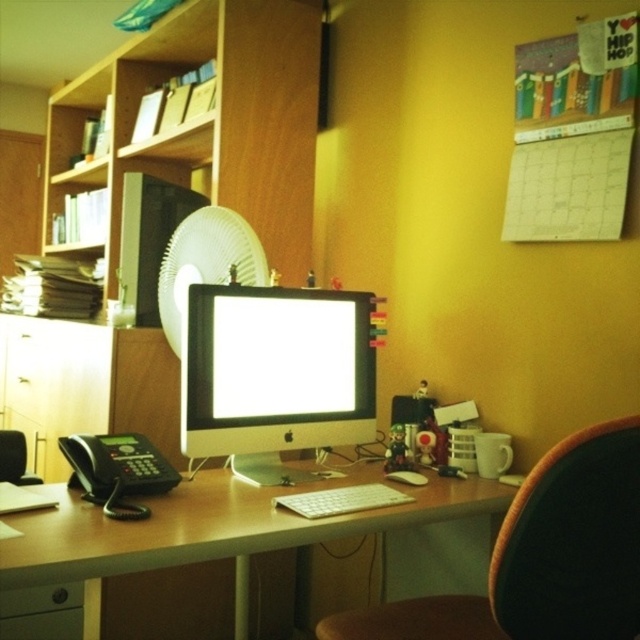
Question: Which object is closer to the camera taking this photo?

Choices:
 (A) black leather swivel chair at center
 (B) wooden bookshelf at upper left
 (C) black leather chair at left
 (D) white plastic computer desk at center

Answer: (A)

Question: Can you confirm if black leather swivel chair at center is wider than white plastic computer desk at center?

Choices:
 (A) yes
 (B) no

Answer: (B)

Question: Is black leather swivel chair at center below satin silver monitor at center?

Choices:
 (A) yes
 (B) no

Answer: (A)

Question: Which is farther from the wooden bookshelf at upper left?

Choices:
 (A) black leather swivel chair at center
 (B) white matte keyboard at center
 (C) white plastic fan at center

Answer: (A)

Question: Is white plastic computer desk at center to the left of satin silver monitor at center from the viewer's perspective?

Choices:
 (A) yes
 (B) no

Answer: (A)

Question: Estimate the real-world distances between objects in this image. Which object is farther from the white plastic computer desk at center?

Choices:
 (A) satin silver monitor at center
 (B) white matte keyboard at center
 (C) white plastic fan at center

Answer: (C)